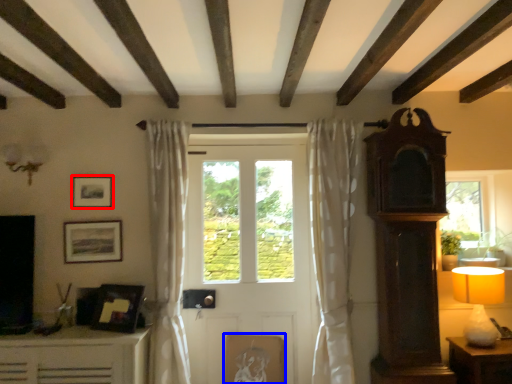
Question: Among these objects, which one is farthest to the camera, picture frame (highlighted by a red box) or picture frame (highlighted by a blue box)?

Choices:
 (A) picture frame
 (B) picture frame

Answer: (B)